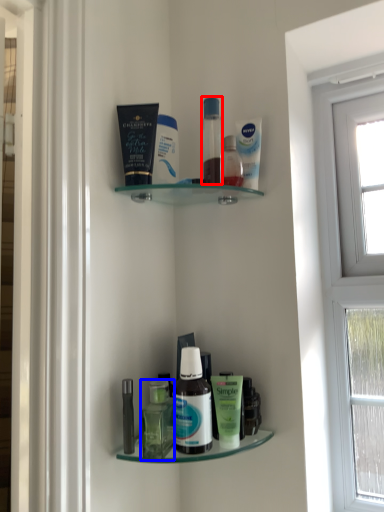
Question: Which object is further to the camera taking this photo, toiletry (highlighted by a red box) or bottle (highlighted by a blue box)?

Choices:
 (A) toiletry
 (B) bottle

Answer: (A)